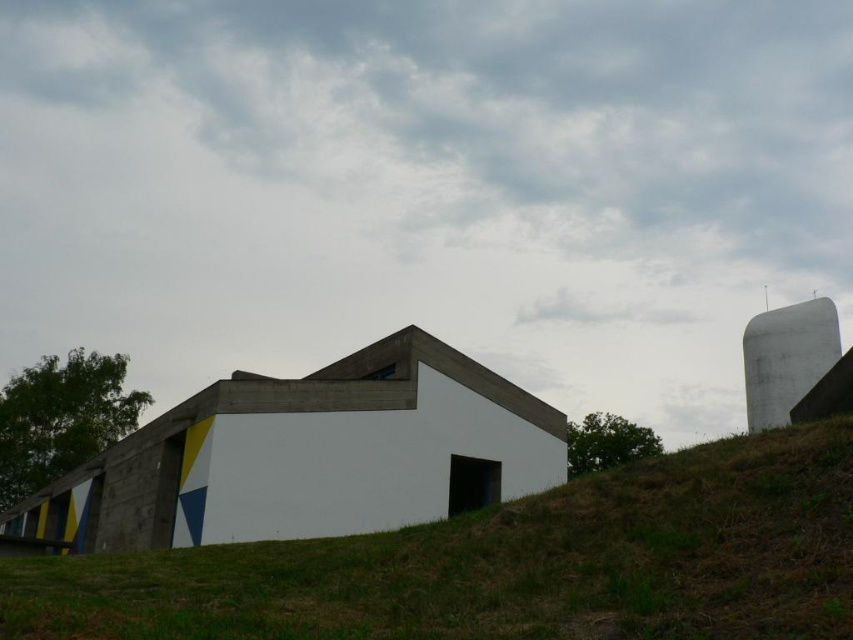
You are standing on the green grassy hillside at lower center and want to reach the white smooth silo at right. Which direction should you walk to get there?

Since the green grassy hillside at lower center is positioned under the white smooth silo at right, you should walk upwards towards the white smooth silo at right to reach it.

You are standing in front of a modern architectural building on a green grassy hillside. You want to place a 5.5 meter long sculpture between you and the green grassy hillside at lower center. Is there enough space between you and the hillside to fit the sculpture?

The distance between the viewer and the green grassy hillside at lower center is 6.07 meters. Since the sculpture is 5.5 meters long, it can be placed between the viewer and the hillside as there is sufficient space.